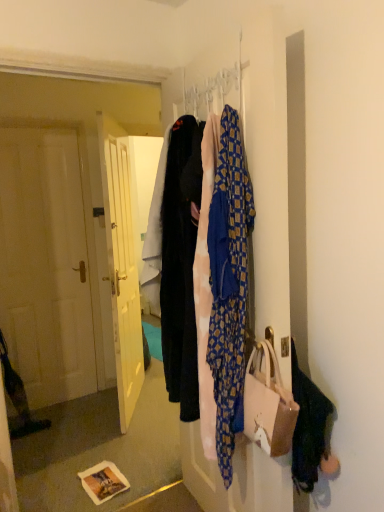
Question: Can you confirm if blue patterned fabric at center is bigger than velvet black pants at center?

Choices:
 (A) yes
 (B) no

Answer: (A)

Question: Is blue patterned fabric at center looking in the opposite direction of velvet black pants at center?

Choices:
 (A) yes
 (B) no

Answer: (B)

Question: Considering the relative sizes of blue patterned fabric at center and velvet black pants at center in the image provided, is blue patterned fabric at center wider than velvet black pants at center?

Choices:
 (A) no
 (B) yes

Answer: (A)

Question: Is blue patterned fabric at center at the left side of velvet black pants at center?

Choices:
 (A) no
 (B) yes

Answer: (A)

Question: Can you confirm if blue patterned fabric at center is smaller than velvet black pants at center?

Choices:
 (A) no
 (B) yes

Answer: (A)

Question: Can you confirm if blue patterned fabric at center is positioned to the right of velvet black pants at center?

Choices:
 (A) yes
 (B) no

Answer: (A)

Question: Is the surface of metallic silver hanger at upper center in direct contact with velvet black pants at center?

Choices:
 (A) yes
 (B) no

Answer: (B)

Question: From the image's perspective, is metallic silver hanger at upper center on velvet black pants at center?

Choices:
 (A) yes
 (B) no

Answer: (A)

Question: From the image's perspective, is metallic silver hanger at upper center below velvet black pants at center?

Choices:
 (A) no
 (B) yes

Answer: (A)

Question: From a real-world perspective, is metallic silver hanger at upper center positioned under velvet black pants at center based on gravity?

Choices:
 (A) no
 (B) yes

Answer: (A)

Question: Does metallic silver hanger at upper center have a smaller size compared to velvet black pants at center?

Choices:
 (A) yes
 (B) no

Answer: (A)

Question: Considering the relative sizes of metallic silver hanger at upper center and velvet black pants at center in the image provided, is metallic silver hanger at upper center taller than velvet black pants at center?

Choices:
 (A) yes
 (B) no

Answer: (B)

Question: Is metallic silver hanger at upper center positioned behind blue patterned fabric at center?

Choices:
 (A) yes
 (B) no

Answer: (A)